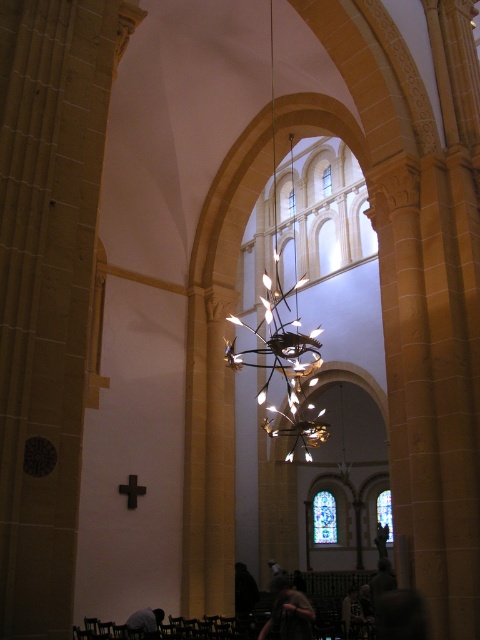
You are standing inside the historic building and notice two points marked on the wall. The first point is at coordinate point (310, 628) and the second is at point (146, 608). Which point is closer to your current position?

Point (310, 628) is closer to the camera than point (146, 608), so the first point is closer to your current position.

You are a visitor standing at the entrance of the cathedral. You see a dark brown leather jacket at lower center and a dark gray fabric at lower center. Which item is closer to you?

The dark brown leather jacket at lower center is closer to you since it is in front of the dark gray fabric at lower center.

Consider the image. You are a visitor in the historic building and you see the dark brown leather jacket at lower center and the dark gray fabric at lower center. Which object is wider?

The dark brown leather jacket at lower center is wider than the dark gray fabric at lower center.